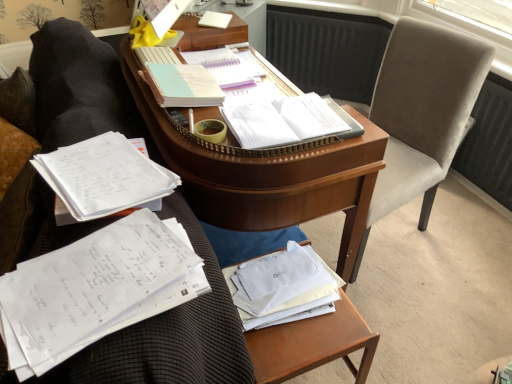
Question: From the image's perspective, is wooden at lower right over wooden desk at center?

Choices:
 (A) yes
 (B) no

Answer: (B)

Question: Is wooden desk at center at the back of wooden at lower right?

Choices:
 (A) no
 (B) yes

Answer: (B)

Question: Would you say wooden at lower right is outside wooden desk at center?

Choices:
 (A) no
 (B) yes

Answer: (B)

Question: Is wooden desk at center inside wooden at lower right?

Choices:
 (A) no
 (B) yes

Answer: (A)

Question: From a real-world perspective, is wooden at lower right located beneath wooden desk at center?

Choices:
 (A) no
 (B) yes

Answer: (B)

Question: Is wooden at lower right at the right side of wooden desk at center?

Choices:
 (A) yes
 (B) no

Answer: (A)

Question: Could wooden at lower right be considered to be inside velvet gray swivel chair at right?

Choices:
 (A) no
 (B) yes

Answer: (A)

Question: Is the position of velvet gray swivel chair at right less distant than that of wooden at lower right?

Choices:
 (A) yes
 (B) no

Answer: (B)

Question: Is velvet gray swivel chair at right smaller than wooden at lower right?

Choices:
 (A) no
 (B) yes

Answer: (A)

Question: Can you confirm if velvet gray swivel chair at right is thinner than wooden at lower right?

Choices:
 (A) yes
 (B) no

Answer: (B)

Question: Does velvet gray swivel chair at right have a greater width compared to wooden at lower right?

Choices:
 (A) yes
 (B) no

Answer: (A)

Question: Does velvet gray swivel chair at right turn towards wooden at lower right?

Choices:
 (A) no
 (B) yes

Answer: (B)

Question: Considering the relative sizes of light blue paper at center, the fourth book from the front, and wooden at lower right in the image provided, is light blue paper at center, the fourth book from the front, thinner than wooden at lower right?

Choices:
 (A) yes
 (B) no

Answer: (A)